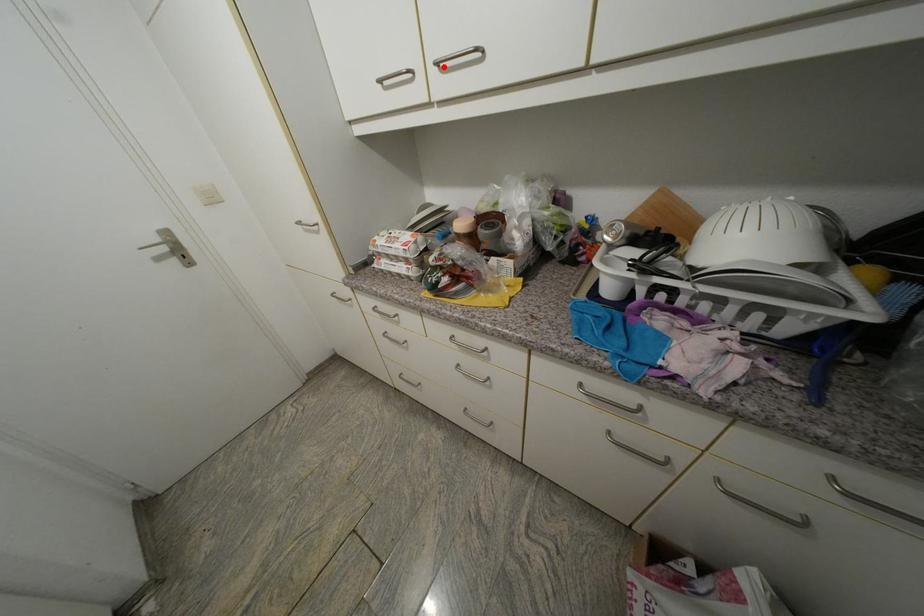
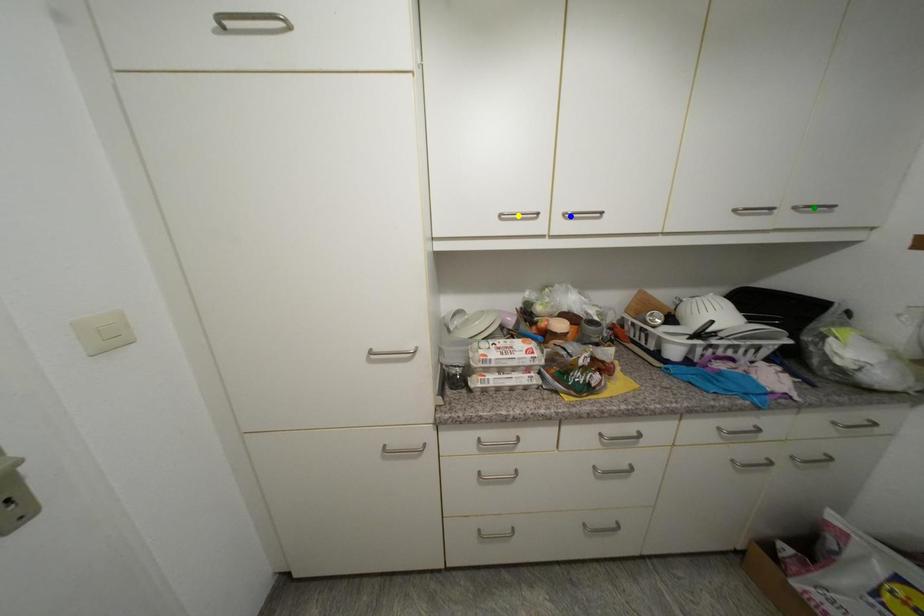
Question: I am providing you with two images of the same scene from different viewpoints. A red point is marked on the first image. You are given multiple points on the second image. Which point in image 2 is actually the same real-world point as the red point in image 1?

Choices:
 (A) blue point
 (B) yellow point
 (C) green point

Answer: (A)